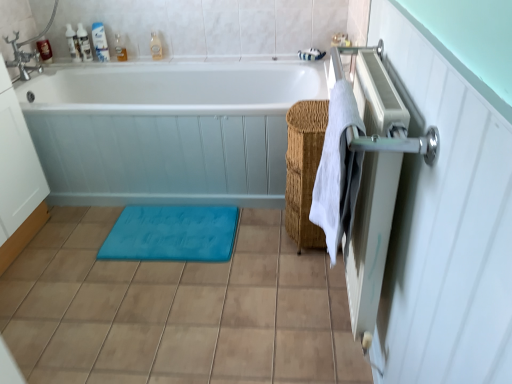
Question: Is translucent plastic bottles at upper left, the second toiletry viewed from the left, touching white glossy bathtub at center?

Choices:
 (A) yes
 (B) no

Answer: (B)

Question: Can you confirm if translucent plastic bottles at upper left, arranged as the 5th toiletry when viewed from the right, is smaller than white glossy bathtub at center?

Choices:
 (A) no
 (B) yes

Answer: (B)

Question: Can you confirm if translucent plastic bottles at upper left, arranged as the 5th toiletry when viewed from the right, is positioned to the right of white glossy bathtub at center?

Choices:
 (A) yes
 (B) no

Answer: (B)

Question: Does translucent plastic bottles at upper left, the second toiletry viewed from the left, have a greater width compared to white glossy bathtub at center?

Choices:
 (A) no
 (B) yes

Answer: (A)

Question: Is translucent plastic bottles at upper left, the second toiletry viewed from the left, outside white glossy bathtub at center?

Choices:
 (A) no
 (B) yes

Answer: (B)

Question: Does translucent plastic bottles at upper left, arranged as the 5th toiletry when viewed from the right, lie behind white glossy bathtub at center?

Choices:
 (A) no
 (B) yes

Answer: (B)

Question: Would you say translucent plastic bottle at upper left, which ranks as the 2th toiletry in right-to-left order, is outside white cotton towel at right?

Choices:
 (A) yes
 (B) no

Answer: (A)

Question: Is translucent plastic bottle at upper left, acting as the fifth toiletry starting from the left, positioned with its back to white cotton towel at right?

Choices:
 (A) no
 (B) yes

Answer: (A)

Question: Considering the relative sizes of translucent plastic bottle at upper left, acting as the fifth toiletry starting from the left, and white cotton towel at right in the image provided, is translucent plastic bottle at upper left, acting as the fifth toiletry starting from the left, thinner than white cotton towel at right?

Choices:
 (A) no
 (B) yes

Answer: (B)

Question: Can you confirm if translucent plastic bottle at upper left, which ranks as the 2th toiletry in right-to-left order, is bigger than white cotton towel at right?

Choices:
 (A) no
 (B) yes

Answer: (A)

Question: Is translucent plastic bottle at upper left, which ranks as the 2th toiletry in right-to-left order, behind white cotton towel at right?

Choices:
 (A) yes
 (B) no

Answer: (A)

Question: Is translucent plastic bottle at upper left, which ranks as the 2th toiletry in right-to-left order, far away from white cotton towel at right?

Choices:
 (A) no
 (B) yes

Answer: (B)

Question: Does translucent plastic bottle at upper center, arranged as the first toiletry when viewed from the right, appear on the left side of translucent plastic bottles at upper left, the second toiletry viewed from the left?

Choices:
 (A) no
 (B) yes

Answer: (A)